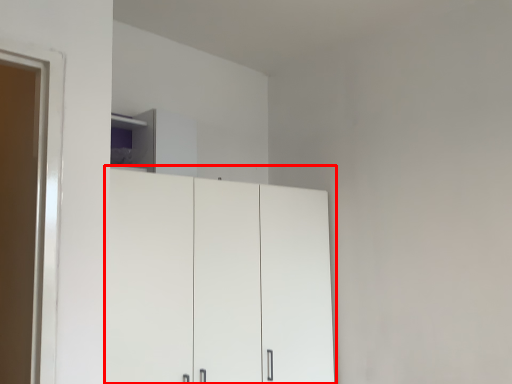
Question: From the image's perspective, what is the correct spatial positioning of cupboard (annotated by the red box) in reference to cabinetry?

Choices:
 (A) above
 (B) below

Answer: (B)